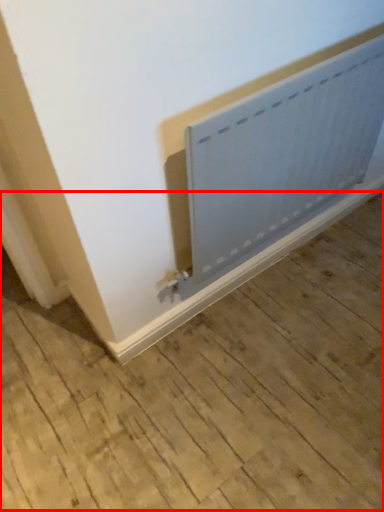
Question: From the image's perspective, what is the correct spatial relationship of plywood (annotated by the red box) in relation to radiator?

Choices:
 (A) below
 (B) above

Answer: (A)